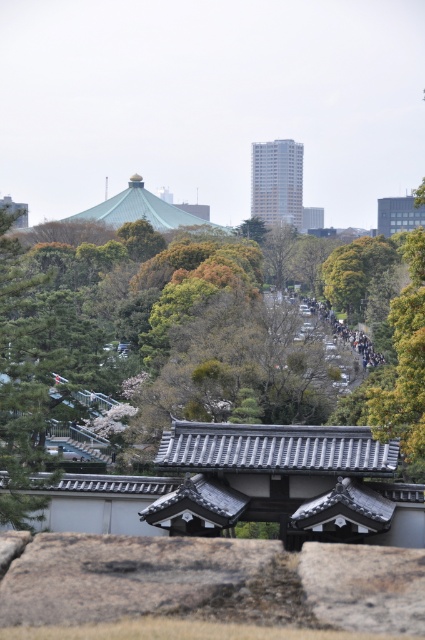
Question: Which of the following is the farthest from the observer?

Choices:
 (A) dark gray concrete crowd at center
 (B) matte gray temple at upper center

Answer: (B)

Question: Which point appears farthest from the camera in this image?

Choices:
 (A) (292, 198)
 (B) (397, 227)
 (C) (186, 364)

Answer: (A)

Question: Is green leafy tree at center above matte gray stone temple at upper center?

Choices:
 (A) no
 (B) yes

Answer: (A)

Question: Does green leafy tree at center come in front of dark gray concrete crowd at center?

Choices:
 (A) yes
 (B) no

Answer: (A)

Question: From the image, what is the correct spatial relationship of green leafy tree at center in relation to matte gray stone temple at upper center?

Choices:
 (A) above
 (B) below

Answer: (B)

Question: Among these objects, which one is farthest from the camera?

Choices:
 (A) dark gray concrete crowd at center
 (B) matte gray temple at upper center
 (C) matte gray stone temple at upper center
 (D) green leafy tree at center

Answer: (B)